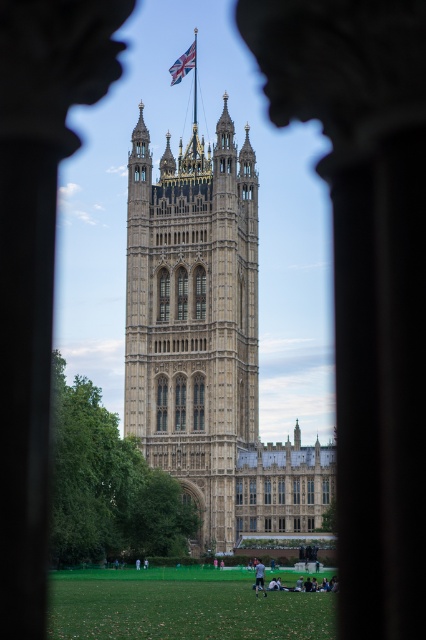
Between beige stone tower at center and union jack fabric at upper center, which one has more height?

With more height is beige stone tower at center.

Between beige stone tower at center and union jack fabric at upper center, which one is positioned lower?

beige stone tower at center

The width and height of the screenshot is (426, 640). In order to click on beige stone tower at center in this screenshot , I will do `click(195, 321)`.

The width and height of the screenshot is (426, 640). Find the location of `beige stone tower at center`. beige stone tower at center is located at coordinates (195, 321).